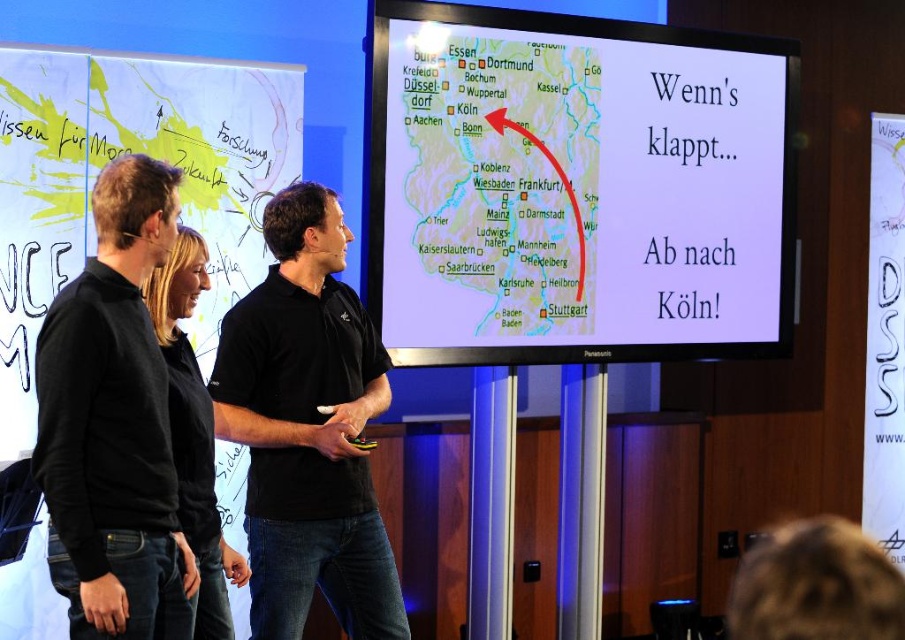
Question: Does black cotton shirt at center appear under black matte sweater at left?

Choices:
 (A) yes
 (B) no

Answer: (A)

Question: Which point appears farthest from the camera in this image?

Choices:
 (A) (155, 243)
 (B) (418, 230)
 (C) (337, 358)
 (D) (56, 230)

Answer: (B)

Question: Which of the following is the closest to the observer?

Choices:
 (A) (331, 595)
 (B) (375, 312)
 (C) (183, 58)
 (D) (129, 428)

Answer: (D)

Question: In this image, where is white paper map at upper center located relative to black cotton shirt at center?

Choices:
 (A) below
 (B) above

Answer: (B)

Question: Does white paper map at upper center appear on the left side of black matte sweater at left?

Choices:
 (A) no
 (B) yes

Answer: (B)

Question: Which object is positioned farthest from the matte map at center?

Choices:
 (A) white paper map at upper center
 (B) black cotton shirt at center
 (C) black matte sweater at left

Answer: (C)